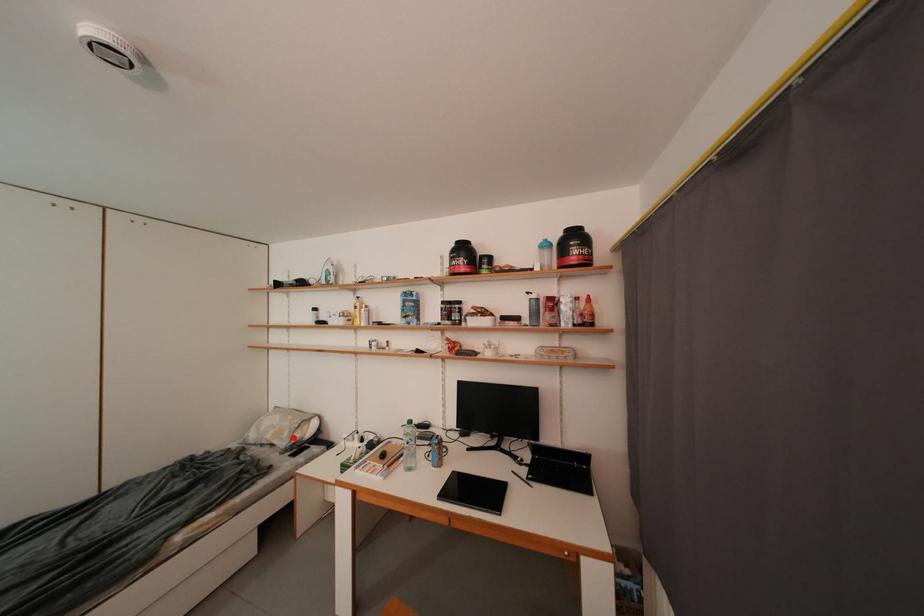
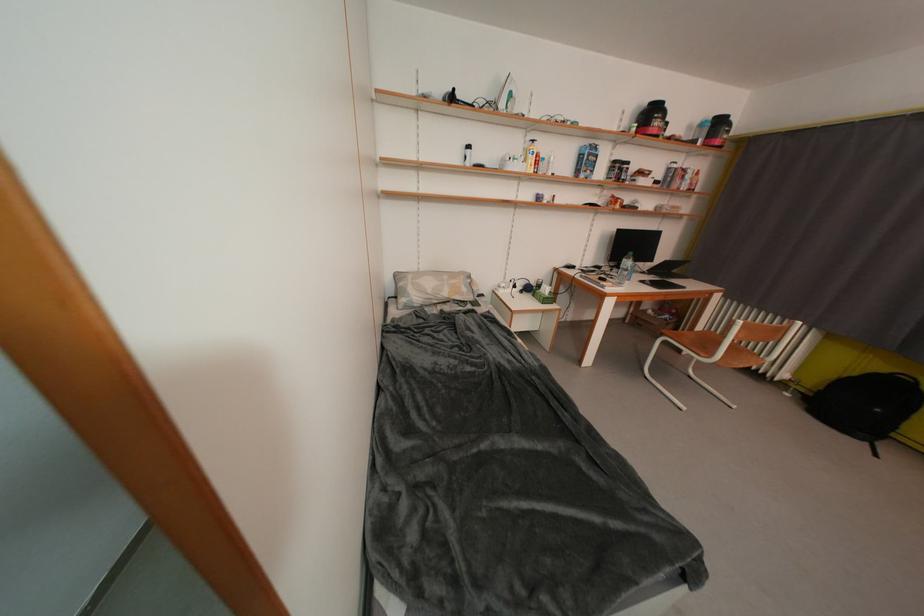
Find the pixel in the second image that matches the highlighted location in the first image.

(471, 293)